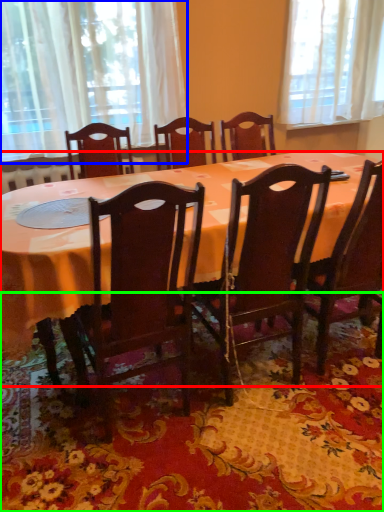
Question: Based on their relative distances, which object is nearer to desk (highlighted by a red box)? Choose from curtain (highlighted by a blue box) and mat (highlighted by a green box).

Choices:
 (A) curtain
 (B) mat

Answer: (B)